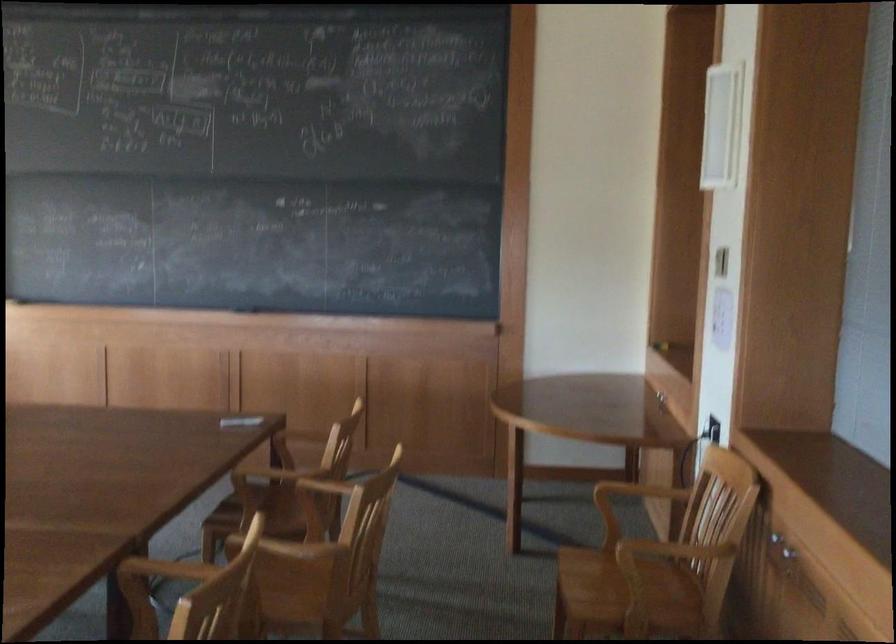
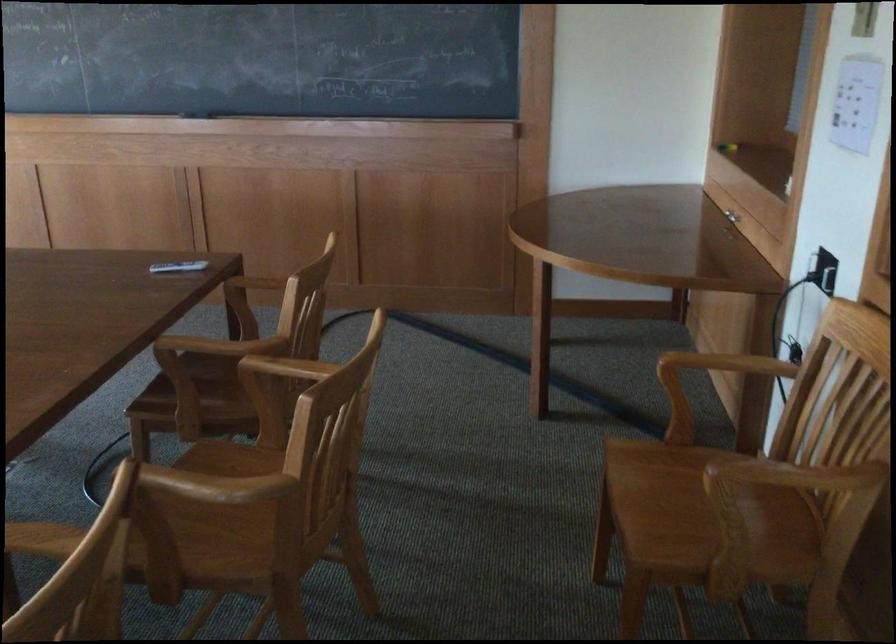
Question: In a continuous first-person perspective shot, in which direction is the camera moving?

Choices:
 (A) Left
 (B) Right
 (C) Forward
 (D) Backward

Answer: (C)